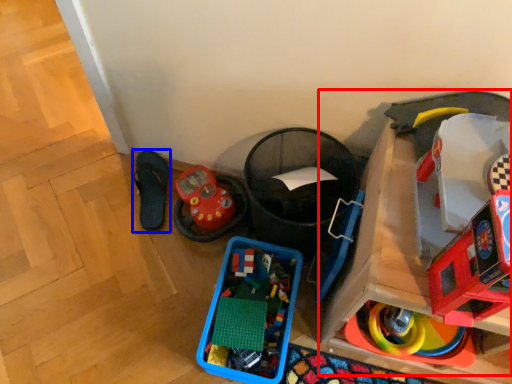
Question: Which object appears closest to the camera in this image, toy (highlighted by a red box) or footwear (highlighted by a blue box)?

Choices:
 (A) toy
 (B) footwear

Answer: (A)